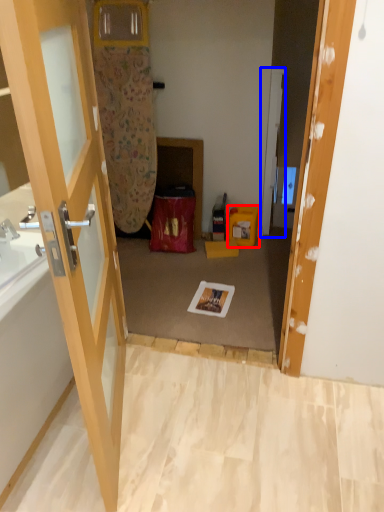
Question: Which point is further to the camera, box (highlighted by a red box) or door (highlighted by a blue box)?

Choices:
 (A) box
 (B) door

Answer: (A)